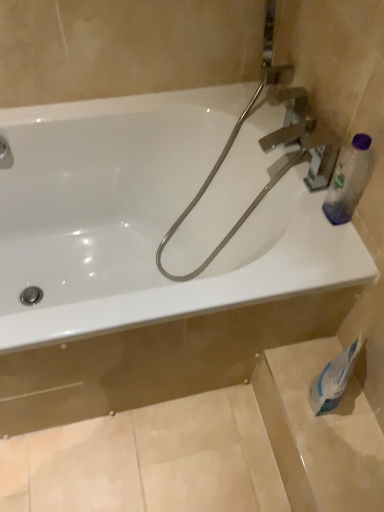
Question: Should I look upward or downward to see metallic silver garden hose at upper right?

Choices:
 (A) down
 (B) up

Answer: (B)

Question: Is matte silver faucet at upper left outside transparent plastic bottle at upper right?

Choices:
 (A) yes
 (B) no

Answer: (A)

Question: Does matte silver faucet at upper left have a lesser width compared to transparent plastic bottle at upper right?

Choices:
 (A) no
 (B) yes

Answer: (A)

Question: Is matte silver faucet at upper left smaller than transparent plastic bottle at upper right?

Choices:
 (A) no
 (B) yes

Answer: (B)

Question: Does matte silver faucet at upper left have a larger size compared to transparent plastic bottle at upper right?

Choices:
 (A) no
 (B) yes

Answer: (A)

Question: Does matte silver faucet at upper left have a greater width compared to transparent plastic bottle at upper right?

Choices:
 (A) yes
 (B) no

Answer: (A)

Question: From the image's perspective, is matte silver faucet at upper left under transparent plastic bottle at upper right?

Choices:
 (A) no
 (B) yes

Answer: (A)

Question: From a real-world perspective, is white glossy bathtub at upper center located higher than matte silver faucet at upper left?

Choices:
 (A) no
 (B) yes

Answer: (A)

Question: Considering the relative positions of white glossy bathtub at upper center and matte silver faucet at upper left in the image provided, is white glossy bathtub at upper center to the right of matte silver faucet at upper left from the viewer's perspective?

Choices:
 (A) no
 (B) yes

Answer: (B)

Question: Is white glossy bathtub at upper center bigger than matte silver faucet at upper left?

Choices:
 (A) yes
 (B) no

Answer: (A)

Question: Is white glossy bathtub at upper center at the left side of matte silver faucet at upper left?

Choices:
 (A) yes
 (B) no

Answer: (B)

Question: Is white glossy bathtub at upper center outside matte silver faucet at upper left?

Choices:
 (A) yes
 (B) no

Answer: (A)

Question: Does white glossy bathtub at upper center come behind matte silver faucet at upper left?

Choices:
 (A) yes
 (B) no

Answer: (B)

Question: Is white glossy bathtub at upper center far away from transparent plastic bottle at upper right?

Choices:
 (A) no
 (B) yes

Answer: (A)